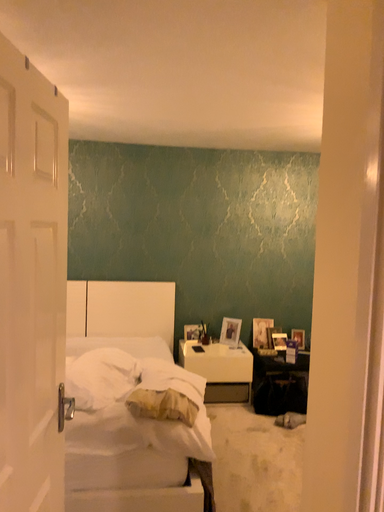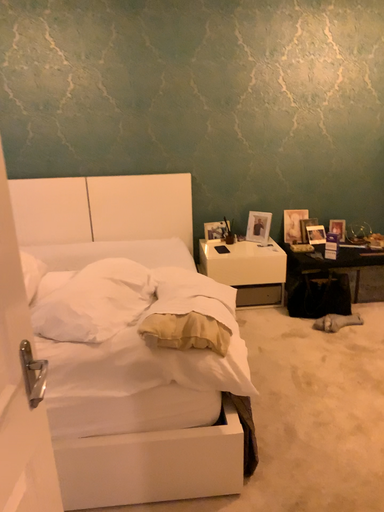
Question: How did the camera likely rotate when shooting the video?

Choices:
 (A) rotated upward
 (B) rotated downward

Answer: (B)